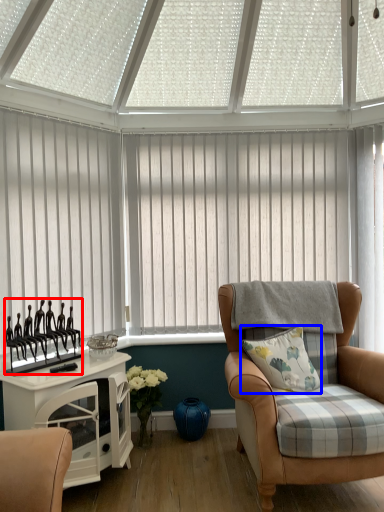
Question: Which object is further to the camera taking this photo, showcase (highlighted by a red box) or pillow (highlighted by a blue box)?

Choices:
 (A) showcase
 (B) pillow

Answer: (B)